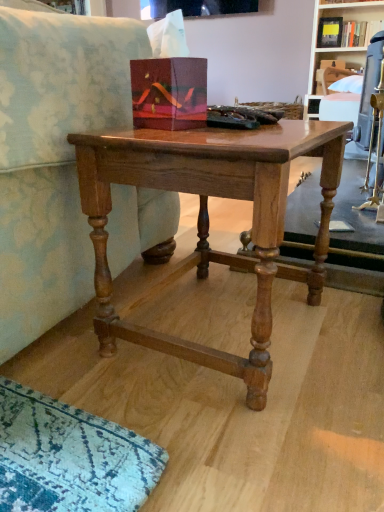
Question: Can you confirm if shiny brown wood table at center is positioned to the right of wooden bookshelf at upper right, placed as the second shelf when sorted from bottom to top?

Choices:
 (A) yes
 (B) no

Answer: (B)

Question: Is shiny brown wood table at center facing towards wooden bookshelf at upper right, which is the first shelf from top to bottom?

Choices:
 (A) no
 (B) yes

Answer: (A)

Question: Can we say shiny brown wood table at center lies outside wooden bookshelf at upper right, placed as the second shelf when sorted from bottom to top?

Choices:
 (A) no
 (B) yes

Answer: (B)

Question: From the image's perspective, is shiny brown wood table at center above wooden bookshelf at upper right, placed as the second shelf when sorted from bottom to top?

Choices:
 (A) no
 (B) yes

Answer: (A)

Question: Does shiny brown wood table at center have a smaller size compared to wooden bookshelf at upper right, which is the first shelf from top to bottom?

Choices:
 (A) yes
 (B) no

Answer: (A)

Question: Are shiny brown wood table at center and wooden bookshelf at upper right, which is the first shelf from top to bottom, far apart?

Choices:
 (A) no
 (B) yes

Answer: (B)

Question: From the image's perspective, is shiny brown wood table at center on wooden shelf at upper right, positioned as the 2th shelf in top-to-bottom order?

Choices:
 (A) yes
 (B) no

Answer: (B)

Question: Is shiny brown wood table at center positioned with its back to wooden shelf at upper right, positioned as the 2th shelf in top-to-bottom order?

Choices:
 (A) no
 (B) yes

Answer: (A)

Question: From a real-world perspective, is shiny brown wood table at center located beneath wooden shelf at upper right, marked as the 1th shelf in a bottom-to-top arrangement?

Choices:
 (A) yes
 (B) no

Answer: (A)

Question: Would you say shiny brown wood table at center contains wooden shelf at upper right, positioned as the 2th shelf in top-to-bottom order?

Choices:
 (A) yes
 (B) no

Answer: (B)

Question: Is shiny brown wood table at center further to the viewer compared to wooden shelf at upper right, marked as the 1th shelf in a bottom-to-top arrangement?

Choices:
 (A) yes
 (B) no

Answer: (B)

Question: Does shiny brown wood table at center appear on the right side of wooden shelf at upper right, marked as the 1th shelf in a bottom-to-top arrangement?

Choices:
 (A) no
 (B) yes

Answer: (A)

Question: From the image's perspective, would you say wooden bookshelf at upper right, which is the first shelf from top to bottom, is positioned over shiny brown wood table at center?

Choices:
 (A) no
 (B) yes

Answer: (B)